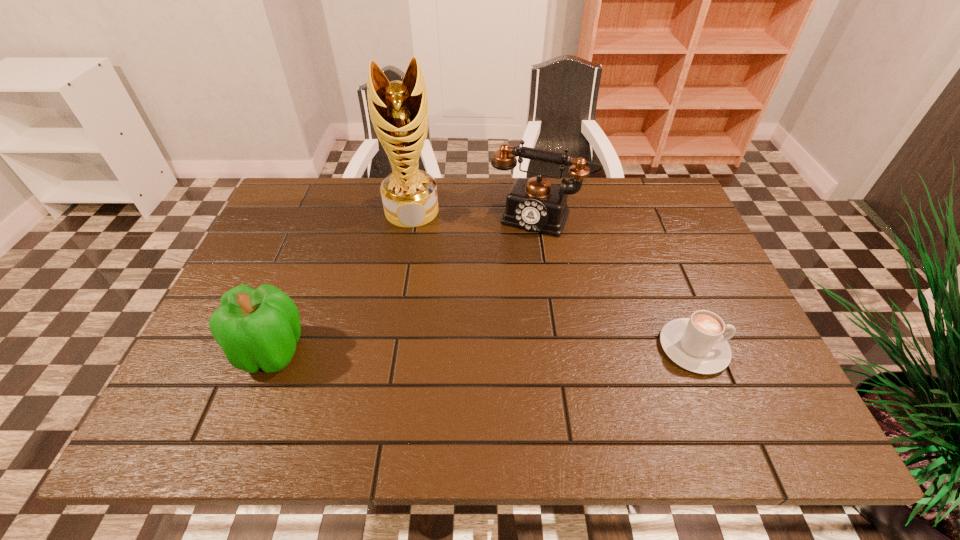
This screenshot has height=540, width=960. Identify the location of free spot on the desktop that is between the leftmost object and the cappuccino and is positioned on the front of the second tallest object at the rotary dial. (486, 349).

Find the location of a particular element. vacant space on the desktop that is between the leftmost object and the cappuccino and is positioned on the front-facing side of the tallest object is located at coordinates (421, 350).